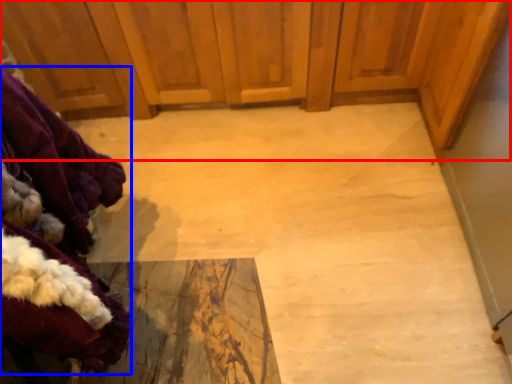
Question: Which object appears closest to the camera in this image, dresser (highlighted by a red box) or clothing (highlighted by a blue box)?

Choices:
 (A) dresser
 (B) clothing

Answer: (B)